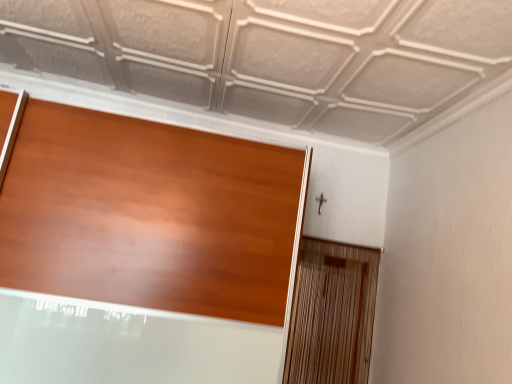
Question: From a real-world perspective, is wooden screen door at right physically located above or below matte wood door at center?

Choices:
 (A) above
 (B) below

Answer: (B)

Question: Does point (343, 271) appear closer or farther from the camera than point (217, 168)?

Choices:
 (A) farther
 (B) closer

Answer: (A)

Question: From their relative heights in the image, would you say wooden screen door at right is taller or shorter than matte wood door at center?

Choices:
 (A) short
 (B) tall

Answer: (A)

Question: From a real-world perspective, is matte wood door at center physically located above or below wooden screen door at right?

Choices:
 (A) below
 (B) above

Answer: (B)

Question: Is point (163, 163) closer or farther from the camera than point (351, 258)?

Choices:
 (A) closer
 (B) farther

Answer: (A)

Question: Is matte wood door at center spatially inside wooden screen door at right, or outside of it?

Choices:
 (A) inside
 (B) outside

Answer: (B)

Question: From the image's perspective, is matte wood door at center positioned above or below wooden screen door at right?

Choices:
 (A) below
 (B) above

Answer: (B)